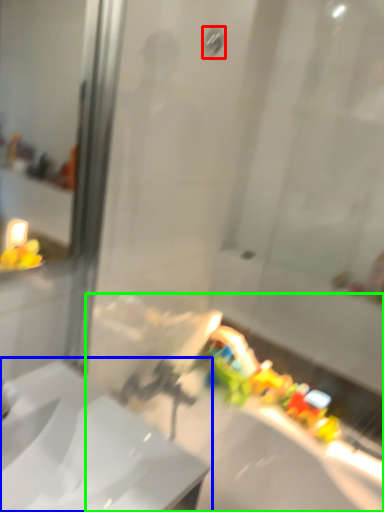
Question: Estimate the real-world distances between objects in this image. Which object is farther from shower (highlighted by a red box), sink (highlighted by a blue box) or bath (highlighted by a green box)?

Choices:
 (A) sink
 (B) bath

Answer: (B)